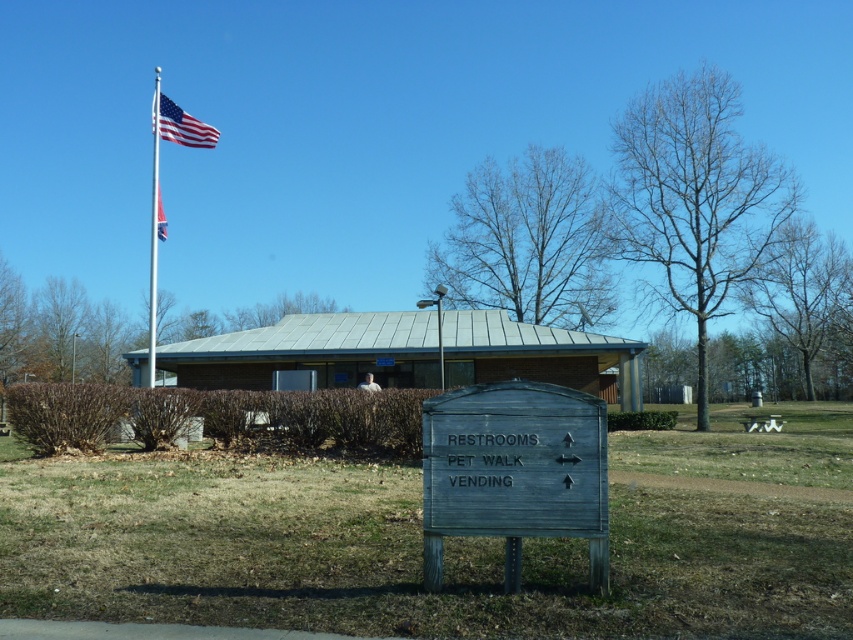
You are standing at the point labeled point (161, 218) and want to walk to the point labeled point (581, 468). Which direction should you face to walk directly towards your destination?

You should face north to walk directly towards point (581, 468) from point (161, 218).

You are a park visitor trying to determine which flag is larger in width between the polished metallic flag at upper center and the american flag at upper left. Based on the scene, which one is wider?

The polished metallic flag at upper center might be wider than american flag at upper left according to the description.

You are standing at the entrance of the building and want to locate the polished metallic flag at upper center. According to the coordinates provided, where should you look relative to the building?

The polished metallic flag at upper center is located at coordinates point (x=180, y=124), which places it to the left of the building.